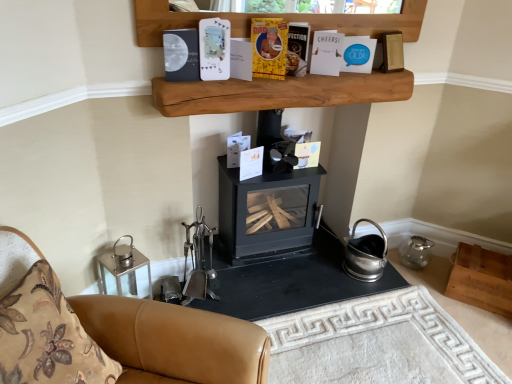
Question: From a real-world perspective, is wooden box at lower right, the second shelf viewed from the left, below blue paper at upper center, the 1th paperback book when ordered from right to left?

Choices:
 (A) no
 (B) yes

Answer: (B)

Question: From the image's perspective, would you say wooden box at lower right, which appears as the second shelf when viewed from the front, is positioned over blue paper at upper center, the 6th paperback book positioned from the left?

Choices:
 (A) no
 (B) yes

Answer: (A)

Question: Is wooden box at lower right, which appears as the second shelf when viewed from the front, facing towards blue paper at upper center, the 6th paperback book positioned from the left?

Choices:
 (A) yes
 (B) no

Answer: (B)

Question: From a real-world perspective, is wooden box at lower right, positioned as the 1th shelf in back-to-front order, on blue paper at upper center, the 1th paperback book when ordered from right to left?

Choices:
 (A) yes
 (B) no

Answer: (B)

Question: Can you confirm if wooden box at lower right, the second shelf viewed from the left, is wider than blue paper at upper center, the 1th paperback book when ordered from right to left?

Choices:
 (A) no
 (B) yes

Answer: (B)

Question: Is yellow paper-covered book at upper center, which ranks as the fourth paperback book in left-to-right order, wider or thinner than yellow paper at upper center, which is counted as the 4th paperback book, starting from the right?

Choices:
 (A) wide
 (B) thin

Answer: (B)

Question: Is yellow paper-covered book at upper center, placed as the 3th paperback book when sorted from right to left, situated inside yellow paper at upper center, which is counted as the 4th paperback book, starting from the right, or outside?

Choices:
 (A) inside
 (B) outside

Answer: (B)

Question: Considering the positions of point (291, 72) and point (261, 19), is point (291, 72) closer or farther from the camera than point (261, 19)?

Choices:
 (A) closer
 (B) farther

Answer: (B)

Question: Is yellow paper-covered book at upper center, placed as the 3th paperback book when sorted from right to left, in front of or behind yellow paper at upper center, which is counted as the 4th paperback book, starting from the right, in the image?

Choices:
 (A) front
 (B) behind

Answer: (B)

Question: Looking at their shapes, would you say white paper at upper center, positioned as the 5th paperback book in left-to-right order, is wider or thinner than natural wood shelf at upper center, marked as the first shelf in a top-to-bottom arrangement?

Choices:
 (A) thin
 (B) wide

Answer: (A)

Question: From their relative heights in the image, would you say white paper at upper center, positioned as the second paperback book in right-to-left order, is taller or shorter than natural wood shelf at upper center, which ranks as the 2th shelf in right-to-left order?

Choices:
 (A) tall
 (B) short

Answer: (A)

Question: Based on their positions, is white paper at upper center, positioned as the 5th paperback book in left-to-right order, located to the left or right of natural wood shelf at upper center, which is the second shelf from back to front?

Choices:
 (A) right
 (B) left

Answer: (A)

Question: From a real-world perspective, is white paper at upper center, positioned as the 5th paperback book in left-to-right order, physically located above or below natural wood shelf at upper center, acting as the 1th shelf starting from the front?

Choices:
 (A) above
 (B) below

Answer: (A)

Question: Considering the positions of point (312, 200) and point (221, 86), is point (312, 200) closer or farther from the camera than point (221, 86)?

Choices:
 (A) farther
 (B) closer

Answer: (A)

Question: Is black matte wood burning stove at center taller or shorter than natural wood shelf at upper center, the 1th shelf when ordered from left to right?

Choices:
 (A) short
 (B) tall

Answer: (B)